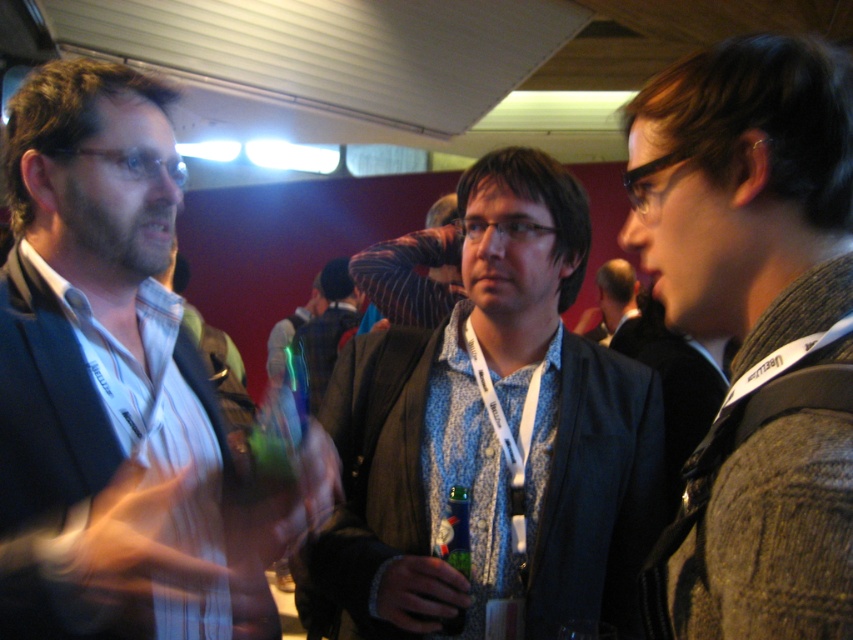
You are standing in the conference room and want to reach a point that is 54.97 centimeters away from you. Can you confirm if the point at coordinates point (730, 636) is exactly at that distance?

Yes, the point (730, 636) is exactly 54.97 centimeters away from the viewer.